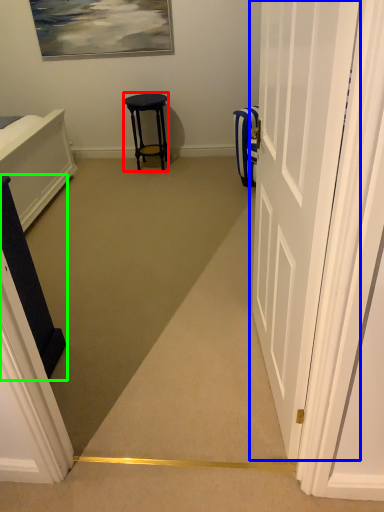
Question: Which object is positioned farthest from stool (highlighted by a red box)? Select from door (highlighted by a blue box) and furniture (highlighted by a green box).

Choices:
 (A) door
 (B) furniture

Answer: (A)